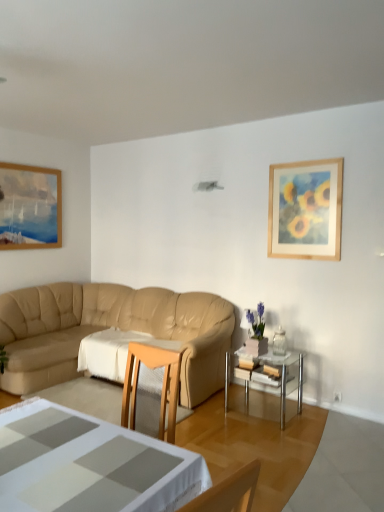
Question: Is wooden framed painting at upper right a part of white glossy coffee table at lower center?

Choices:
 (A) no
 (B) yes

Answer: (A)

Question: Is the position of white glossy coffee table at lower center more distant than that of wooden framed painting at upper right?

Choices:
 (A) yes
 (B) no

Answer: (B)

Question: From a real-world perspective, is white glossy coffee table at lower center beneath wooden framed painting at upper right?

Choices:
 (A) no
 (B) yes

Answer: (B)

Question: Can you confirm if white glossy coffee table at lower center is shorter than wooden framed painting at upper right?

Choices:
 (A) no
 (B) yes

Answer: (B)

Question: Is white glossy coffee table at lower center turned away from wooden framed painting at upper right?

Choices:
 (A) no
 (B) yes

Answer: (A)

Question: Is wooden framed painting at upper right in front of or behind matte pink vase at right in the image?

Choices:
 (A) front
 (B) behind

Answer: (B)

Question: Considering the positions of wooden framed painting at upper right and matte pink vase at right in the image, is wooden framed painting at upper right bigger or smaller than matte pink vase at right?

Choices:
 (A) small
 (B) big

Answer: (B)

Question: Do you think wooden framed painting at upper right is within matte pink vase at right, or outside of it?

Choices:
 (A) outside
 (B) inside

Answer: (A)

Question: Considering the positions of point (324, 236) and point (261, 324), is point (324, 236) closer or farther from the camera than point (261, 324)?

Choices:
 (A) farther
 (B) closer

Answer: (A)

Question: Is beige leather couch at center wider or thinner than wooden framed painting at upper right?

Choices:
 (A) wide
 (B) thin

Answer: (A)

Question: Does point (77, 330) appear closer or farther from the camera than point (276, 212)?

Choices:
 (A) farther
 (B) closer

Answer: (A)

Question: Is beige leather couch at center to the left or to the right of wooden framed painting at upper right in the image?

Choices:
 (A) right
 (B) left

Answer: (B)

Question: From a real-world perspective, is beige leather couch at center positioned above or below wooden framed painting at upper right?

Choices:
 (A) above
 (B) below

Answer: (B)

Question: Is wooden framed painting at upper right inside or outside of white fabric tablecloth at center?

Choices:
 (A) outside
 (B) inside

Answer: (A)

Question: Considering their positions, is wooden framed painting at upper right located in front of or behind white fabric tablecloth at center?

Choices:
 (A) front
 (B) behind

Answer: (A)